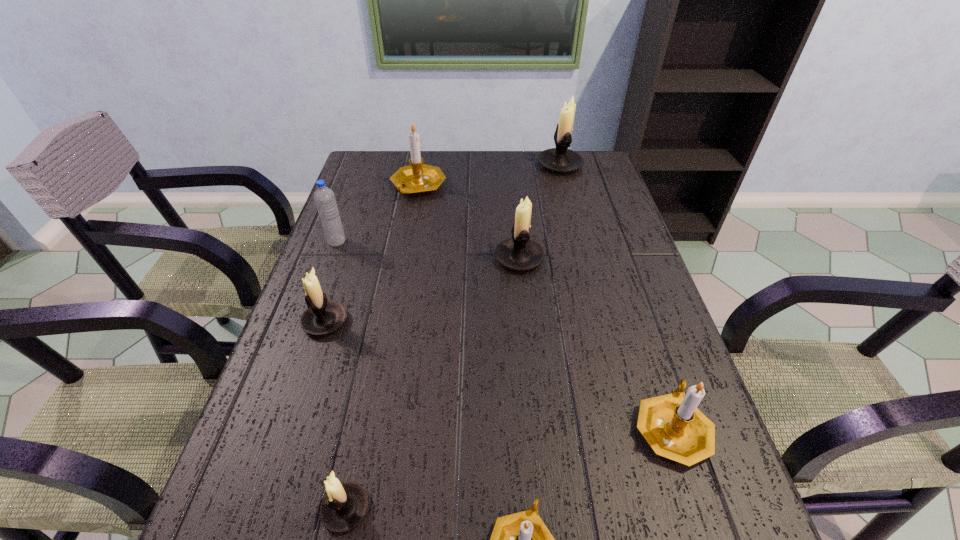
Identify which white candle holder is the fourth closest to the leftmost gold candle holder. Please provide its 2D coordinates. Your answer should be formatted as a tuple, i.e. [(x, y)], where the tuple contains the x and y coordinates of a point satisfying the conditions above.

[(345, 505)]

At what (x,y) coordinates should I click in order to perform the action: click on the closest white candle holder relative to the rightmost gold candle holder. Please return your answer as a coordinate pair (x, y). The height and width of the screenshot is (540, 960). Looking at the image, I should click on (520, 253).

The width and height of the screenshot is (960, 540). I want to click on gold candle holder that stands as the second closest to the second white candle holder from left to right, so click(x=672, y=425).

Locate an element on the screen. This screenshot has height=540, width=960. gold candle holder that stands as the third closest to the fifth nearest candle holder is located at coordinates (x=521, y=539).

This screenshot has width=960, height=540. Find the location of `vacant space that satisfies the following two spatial constraints: 1. on the front side of the third white candle holder from left to right; 2. on the left side of the rightmost gold candle holder`. vacant space that satisfies the following two spatial constraints: 1. on the front side of the third white candle holder from left to right; 2. on the left side of the rightmost gold candle holder is located at coordinates (536, 428).

Locate an element on the screen. free space that satisfies the following two spatial constraints: 1. on the back side of the tallest candle holder; 2. on the left side of the blue water bottle is located at coordinates click(365, 165).